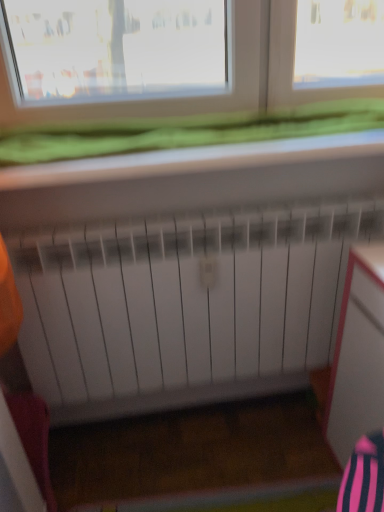
The height and width of the screenshot is (512, 384). In order to click on free point below white matte radiator at center (from a real-world perspective) in this screenshot , I will do click(x=204, y=415).